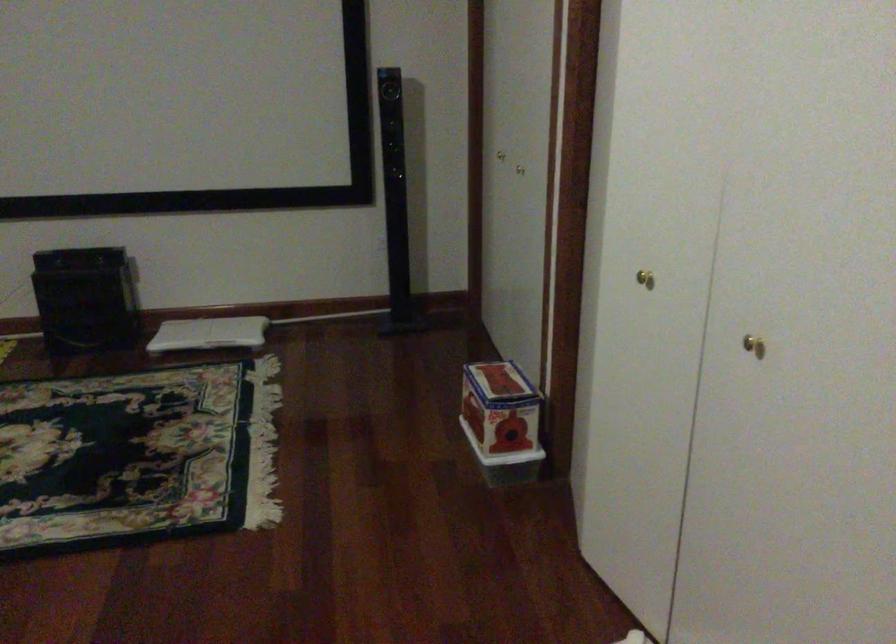
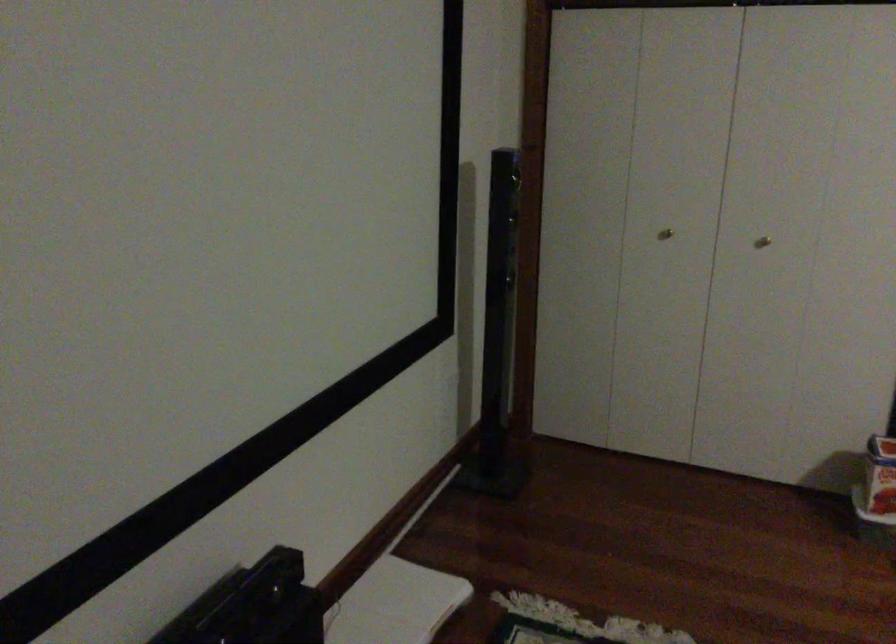
In the second image, find the point that corresponds to (x=216, y=327) in the first image.

(394, 603)